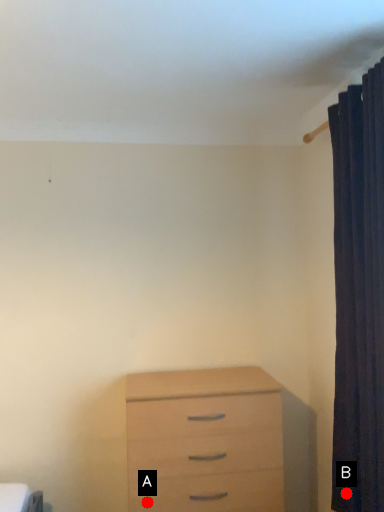
Question: Two points are circled on the image, labeled by A and B beside each circle. Which of the following is the closest to the observer?

Choices:
 (A) A is closer
 (B) B is closer

Answer: (B)